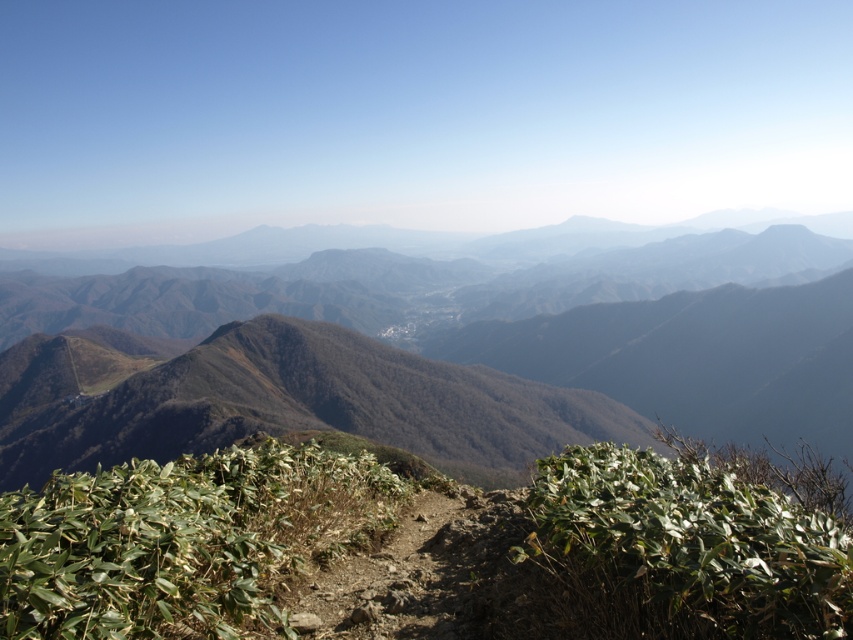
You are standing at the highest point of the mountain and looking down. There is a green leafy shrub at center. Can you see the point marked at coordinates (183, 540) from your current position?

Yes, the point marked at coordinates (183, 540) corresponds to the green leafy shrub at center, so you can see it from your current position.